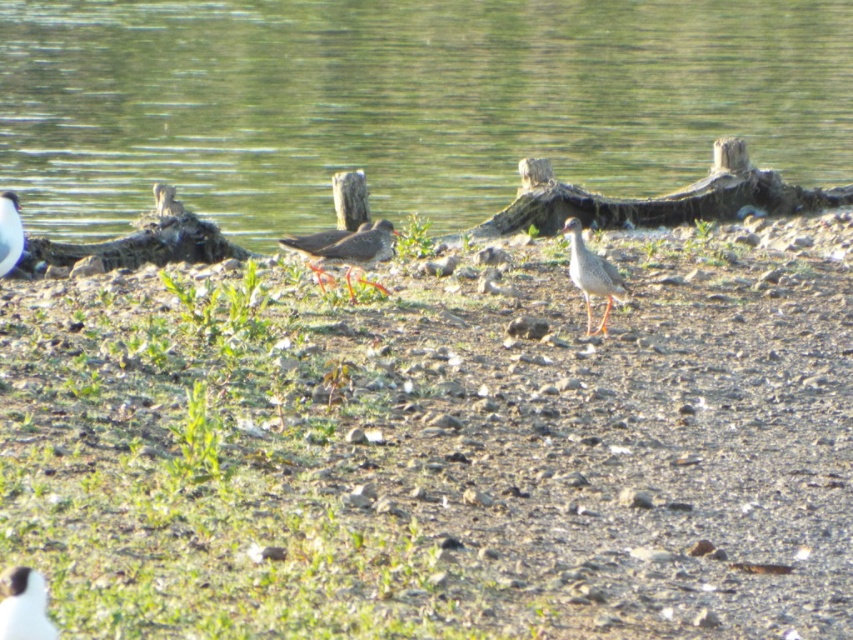
You are a birdwatcher observing the scene. You notice the white matte bird at lower left and the speckled gray bird at center. Which bird is closer to the camera based on their sizes?

The white matte bird at lower left has a smaller size compared to the speckled gray bird at center, so it is farther away from the camera since smaller size indicates distance.

You are standing at the origin point in the image and want to walk towards the point at the bottom of the image. Which point, point [354,300] or point [607,304], is closer to your path?

Point [354,300] is behind point [607,304], so the point [607,304] is closer to your path towards the bottom of the image.

You are standing at the edge of the lakeside and want to locate the green water at center. According to the coordinates provided, where exactly would you find it?

The green water at center is located at the coordinates point (402, 104).